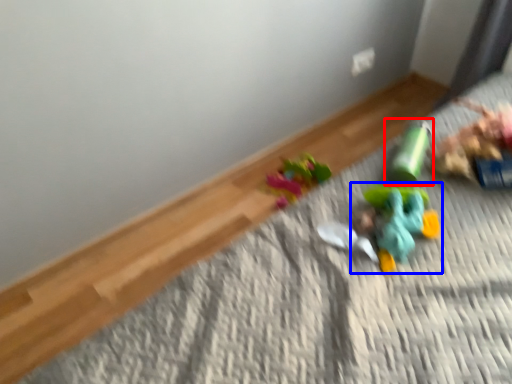
Question: Which object appears farthest to the camera in this image, toy (highlighted by a red box) or toy (highlighted by a blue box)?

Choices:
 (A) toy
 (B) toy

Answer: (A)